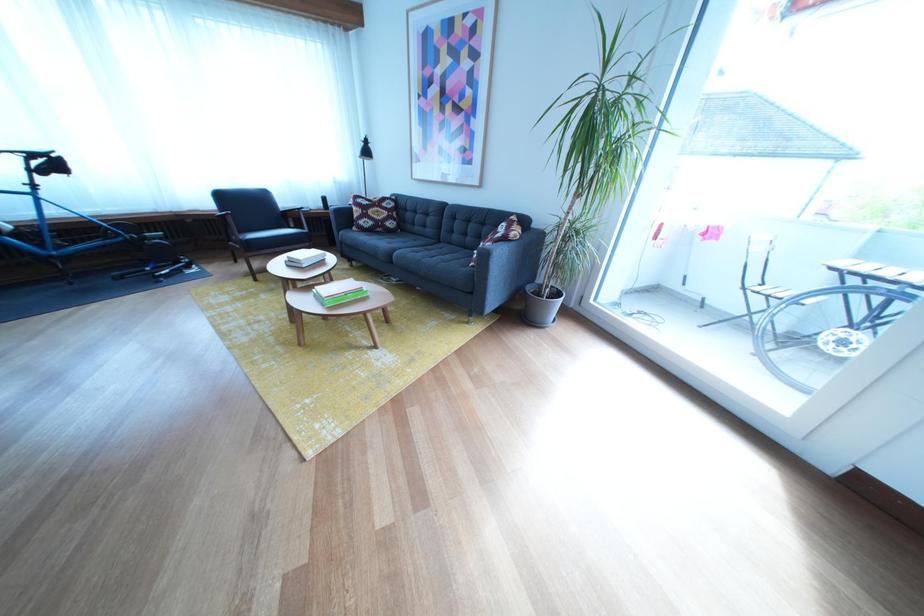
Locate an element on the screen. The image size is (924, 616). grey sofa sitting surface is located at coordinates (432, 257).